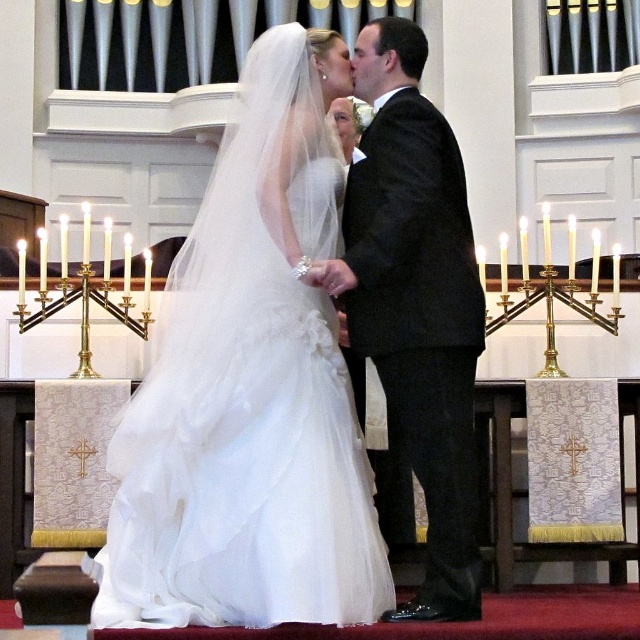
You are a photographer at the wedding and want to ensure the white tulle dress at center and the black satin suit at center are both visible in the photo. Based on their positions, which one is closer to the camera?

The white tulle dress at center is in front of the black satin suit at center, so it is closer to the camera.

You are a photographer standing at the back of the church. You want to take a photo of the white tulle dress at center and the black satin suit at center. Based on their widths, which one should you focus on first to ensure they both fit in the frame?

The white tulle dress at center might be wider than the black satin suit at center, so you should focus on the white tulle dress at center first to ensure it fits in the frame.

Looking at this image, in the wedding scene at the church, you see the white tulle dress at center and the black satin suit at center. Which one is positioned more to the left?

The white tulle dress at center is positioned more to the left than the black satin suit at center.